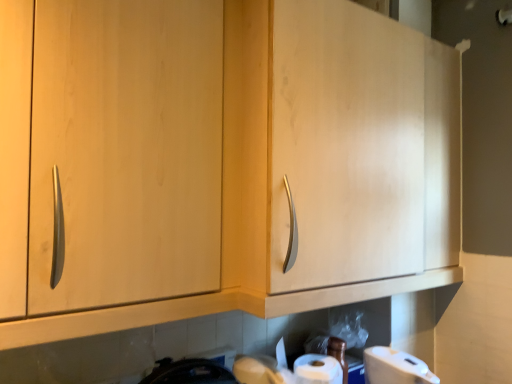
Question: Is the depth of matte wood cabinet at center less than that of white matte toilet paper at lower right?

Choices:
 (A) no
 (B) yes

Answer: (B)

Question: Could you tell me if matte wood cabinet at center is facing white matte toilet paper at lower right?

Choices:
 (A) yes
 (B) no

Answer: (B)

Question: From the image's perspective, would you say matte wood cabinet at center is positioned over white matte toilet paper at lower right?

Choices:
 (A) yes
 (B) no

Answer: (A)

Question: Does matte wood cabinet at center have a larger size compared to white matte toilet paper at lower right?

Choices:
 (A) yes
 (B) no

Answer: (A)

Question: Are matte wood cabinet at center and white matte toilet paper at lower right making contact?

Choices:
 (A) no
 (B) yes

Answer: (A)

Question: Is matte wood cabinet at center located outside white matte toilet paper at lower right?

Choices:
 (A) yes
 (B) no

Answer: (A)

Question: From a real-world perspective, is white matte toilet paper at lower right located higher than matte wood cabinet at center?

Choices:
 (A) no
 (B) yes

Answer: (A)

Question: Is matte wood cabinet at center at the back of white matte toilet paper at lower right?

Choices:
 (A) yes
 (B) no

Answer: (B)

Question: Is white matte toilet paper at lower right not close to matte wood cabinet at center?

Choices:
 (A) no
 (B) yes

Answer: (A)

Question: Can you confirm if white matte toilet paper at lower right is shorter than matte wood cabinet at center?

Choices:
 (A) yes
 (B) no

Answer: (A)

Question: From the image's perspective, is white matte toilet paper at lower right on matte wood cabinet at center?

Choices:
 (A) no
 (B) yes

Answer: (A)

Question: Is matte wood cabinet at center completely or partially inside white matte toilet paper at lower right?

Choices:
 (A) yes
 (B) no

Answer: (B)

Question: Is point (396, 266) positioned closer to the camera than point (388, 360)?

Choices:
 (A) closer
 (B) farther

Answer: (B)